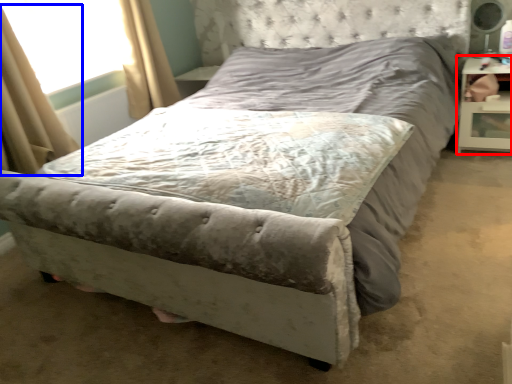
Question: Which object is closer to the camera taking this photo, nightstand (highlighted by a red box) or curtain (highlighted by a blue box)?

Choices:
 (A) nightstand
 (B) curtain

Answer: (B)